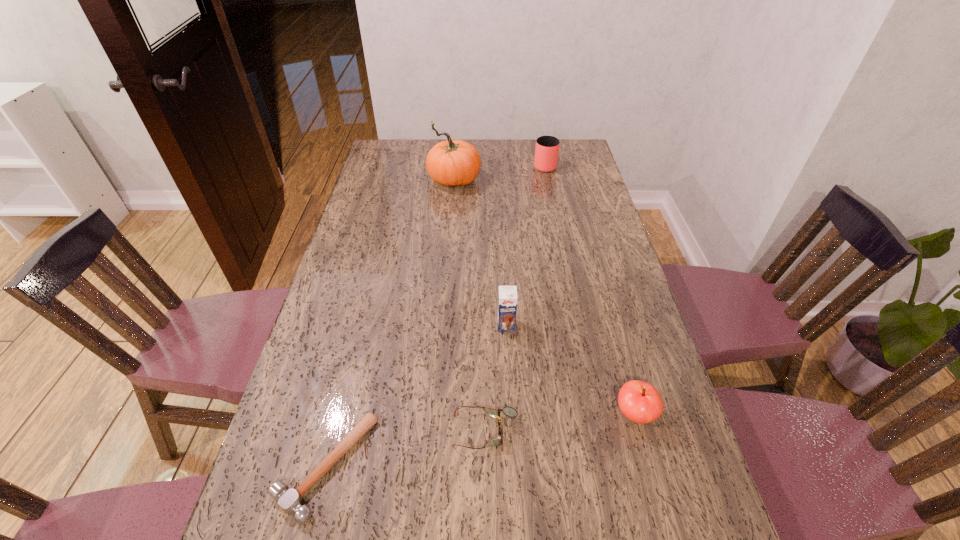
Image resolution: width=960 pixels, height=540 pixels. Identify the location of apple that is at the right edge. (640, 402).

Locate an element on the screen. This screenshot has width=960, height=540. object located in the far right corner section of the desktop is located at coordinates (547, 147).

Where is `free region at the far edge`? Image resolution: width=960 pixels, height=540 pixels. free region at the far edge is located at coordinates (416, 147).

Identify the location of vacant region at the left edge. (339, 309).

Find the location of a particular element. vacant region at the right edge of the desktop is located at coordinates (675, 414).

Identify the location of free space at the far right corner of the desktop. (560, 150).

This screenshot has height=540, width=960. Identify the location of free point between the apple and the tallest object. (544, 298).

Locate an element on the screen. vacant area between the hammer and the fourth nearest object is located at coordinates (416, 395).

Identify the location of free space between the chocolate milk and the pumpkin. The image size is (960, 540). (480, 253).

Locate an element on the screen. unoccupied position between the pumpkin and the fourth nearest object is located at coordinates (480, 253).